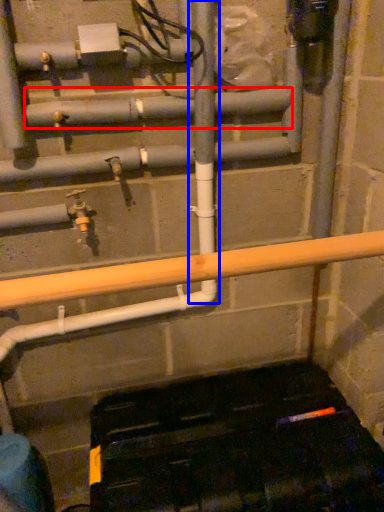
Question: Which of the following is the farthest to the observer, pipe (highlighted by a red box) or pole (highlighted by a blue box)?

Choices:
 (A) pipe
 (B) pole

Answer: (A)